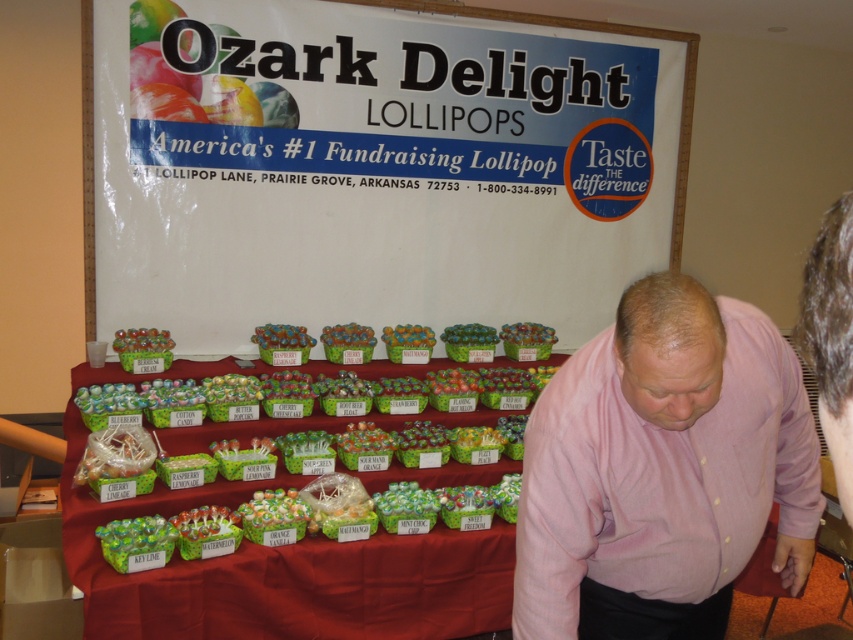
Measure the distance between green paper wrapped lollipops at center and pink shirt at lower right.

green paper wrapped lollipops at center is 7.41 feet away from pink shirt at lower right.

Who is higher up, green paper wrapped lollipops at center or pink shirt at lower right?

green paper wrapped lollipops at center

Is point (341, 584) closer to viewer compared to point (837, 259)?

No, (341, 584) is further to viewer.

What are the coordinates of `green paper wrapped lollipops at center` in the screenshot? It's located at (280, 570).

Is white paperboard at upper center closer to the viewer compared to pink shirt at lower right?

No.

Is white paperboard at upper center positioned behind pink shirt at lower right?

Yes, it is behind pink shirt at lower right.

Measure the distance between point (213, 259) and camera.

They are 3.69 meters apart.

This screenshot has height=640, width=853. Identify the location of white paperboard at upper center. (373, 164).

Between point (741, 342) and point (287, 426), which one is positioned behind?

Point (287, 426)

Can you confirm if pink cotton shirt at lower right is shorter than green paper wrapped lollipops at center?

Yes, pink cotton shirt at lower right is shorter than green paper wrapped lollipops at center.

Which is behind, point (737, 452) or point (467, 545)?

Point (467, 545)

Identify the location of pink cotton shirt at lower right. This screenshot has width=853, height=640. [663, 470].